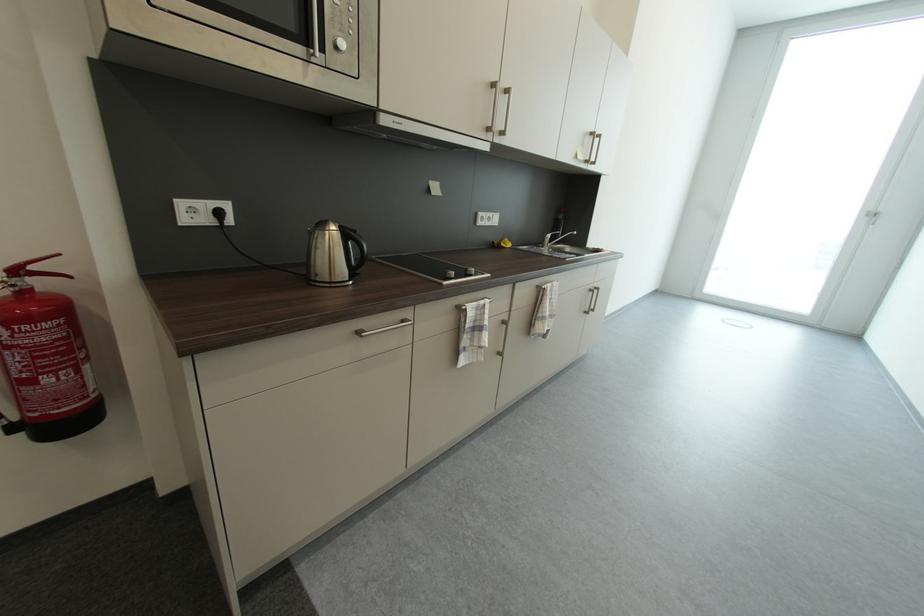
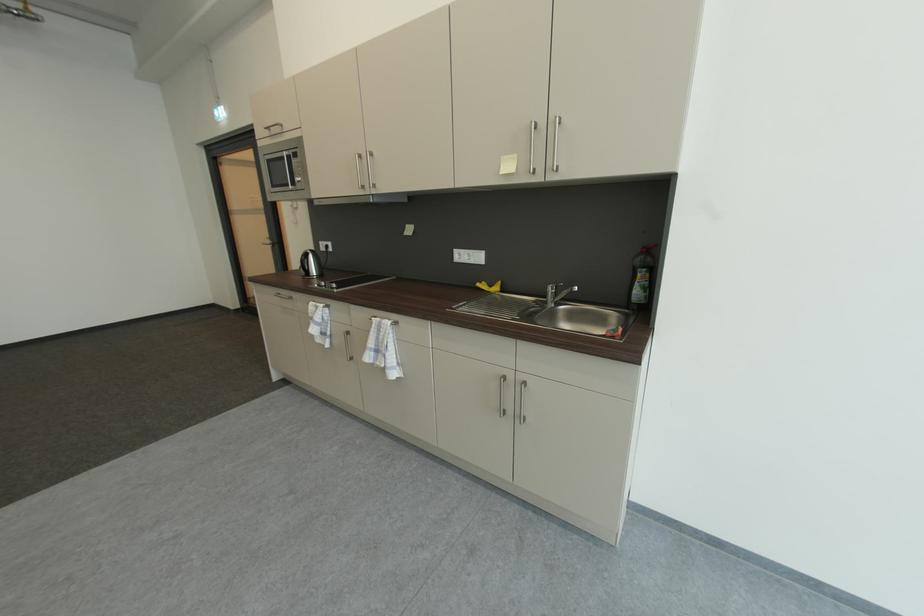
The point at (501,244) is marked in the first image. Where is the corresponding point in the second image?

(487, 284)